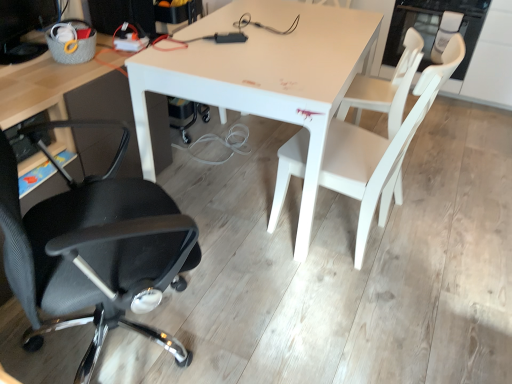
You are a GUI agent. You are given a task and a screenshot of the screen. Output one action in this format:
    pyautogui.click(x=<x>, y=<y>)
    Task: Click on the vacant space to the right of white matte chair at center, the 2th chair in the left-to-right sequence
    The image size is (512, 384).
    Given the screenshot: What is the action you would take?
    pyautogui.click(x=438, y=239)